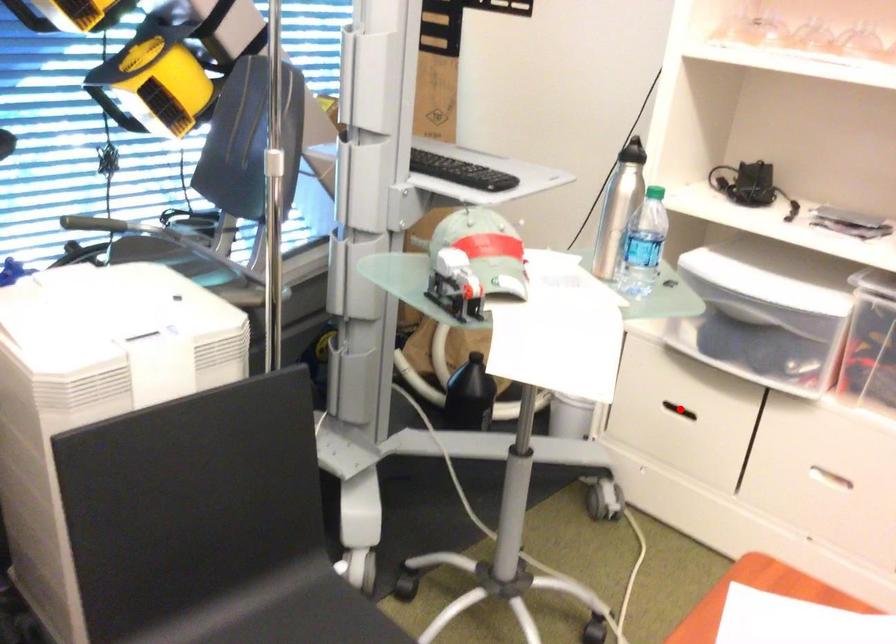
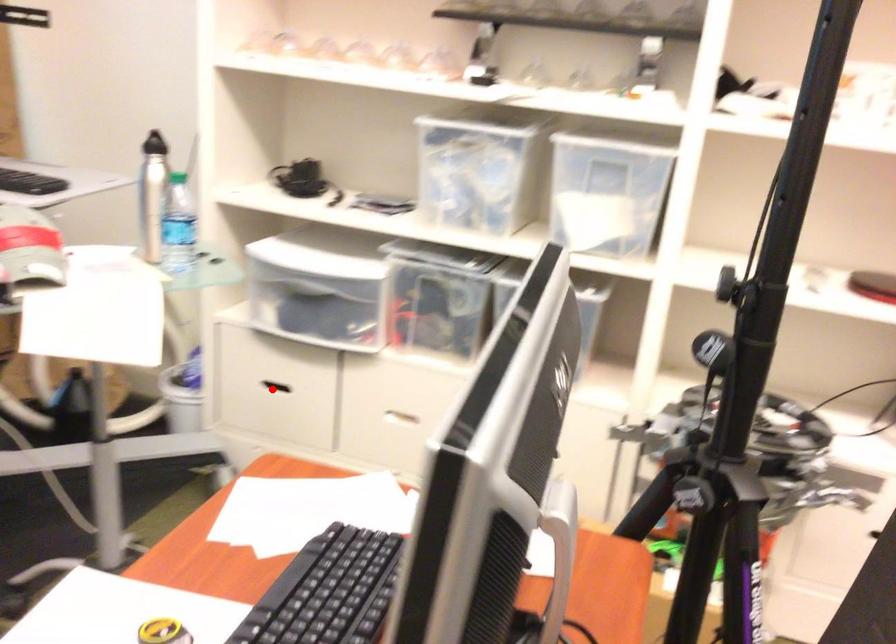
I am providing you with two images of the same scene from different viewpoints. A red point is marked on the first image and another point is marked on the second image. Is the marked point in image1 the same physical position as the marked point in image2?

Yes